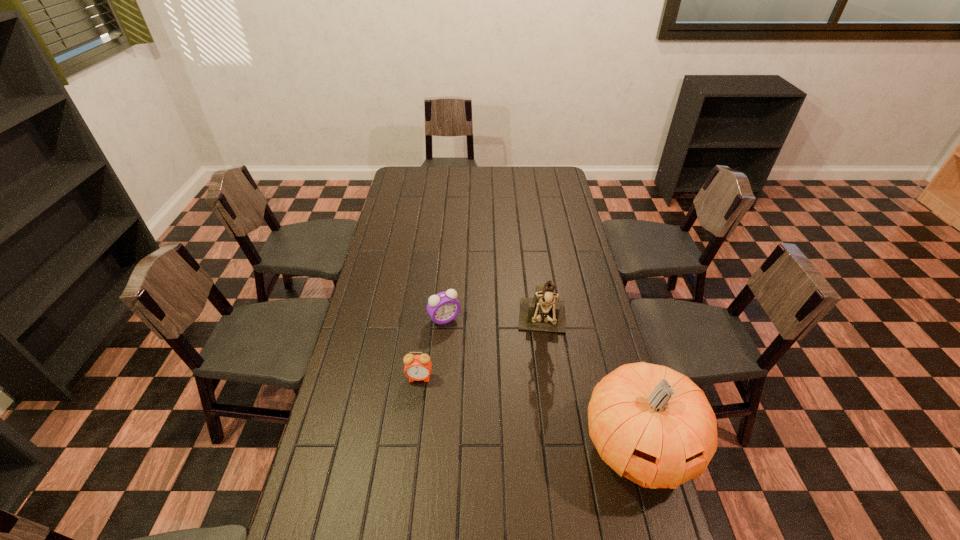
Locate an element on the screen. The width and height of the screenshot is (960, 540). the nearer alarm clock is located at coordinates (417, 367).

Where is `pumpkin`? The height and width of the screenshot is (540, 960). pumpkin is located at coordinates (649, 422).

Find the location of a particular element. The width and height of the screenshot is (960, 540). the farther alarm clock is located at coordinates (443, 307).

Find the location of a particular element. Image resolution: width=960 pixels, height=540 pixels. figurine is located at coordinates (543, 313).

Locate an element on the screen. The image size is (960, 540). vacant area situated on the face of the nearer alarm clock is located at coordinates (413, 436).

Where is `free space located 0.100m on the face of the farther alarm clock`? The height and width of the screenshot is (540, 960). free space located 0.100m on the face of the farther alarm clock is located at coordinates (465, 347).

Where is `free space located on the face of the farther alarm clock`? This screenshot has height=540, width=960. free space located on the face of the farther alarm clock is located at coordinates (465, 347).

At what (x,y) coordinates should I click in order to perform the action: click on vacant area situated 0.310m on the face of the farther alarm clock. Please return your answer as a coordinate pair (x, y). Looking at the image, I should click on (494, 393).

You are a GUI agent. You are given a task and a screenshot of the screen. Output one action in this format:
    pyautogui.click(x=<x>, y=<y>)
    Task: Click on the vacant space located on the front-facing side of the figurine
    This screenshot has height=540, width=960.
    Given the screenshot: What is the action you would take?
    pyautogui.click(x=544, y=393)

Locate an element on the screen. The width and height of the screenshot is (960, 540). vacant space located on the front-facing side of the figurine is located at coordinates coord(543,437).